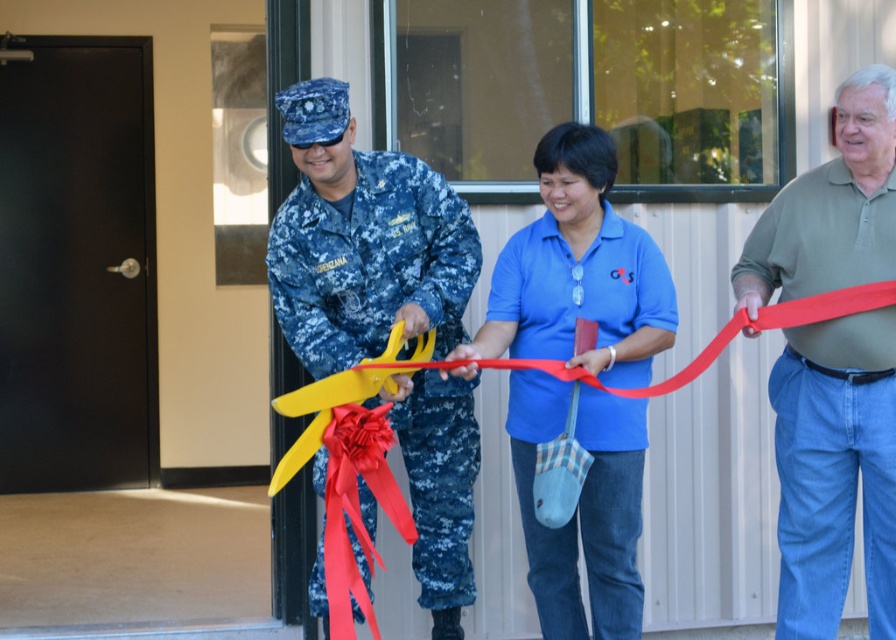
Does yellow matte scissors at center appear under silky red ribbon at center?

No, yellow matte scissors at center is not below silky red ribbon at center.

Measure the distance between yellow matte scissors at center and camera.

The distance of yellow matte scissors at center from camera is 13.41 feet.

You are a GUI agent. You are given a task and a screenshot of the screen. Output one action in this format:
    pyautogui.click(x=<x>, y=<y>)
    Task: Click on the yellow matte scissors at center
    
    Given the screenshot: What is the action you would take?
    pyautogui.click(x=564, y=381)

Is yellow matte scissors at center shorter than green cotton polo shirt at right?

Yes.

Who is taller, yellow matte scissors at center or green cotton polo shirt at right?

With more height is green cotton polo shirt at right.

Which is behind, point (627, 573) or point (786, 227)?

The point (627, 573) is behind.

Locate an element on the screen. Image resolution: width=896 pixels, height=640 pixels. yellow matte scissors at center is located at coordinates (564, 381).

Which is in front, point (597, 586) or point (438, 305)?

Positioned in front is point (438, 305).

Locate an element on the screen. This screenshot has height=640, width=896. blue cotton shirt at center is located at coordinates (578, 272).

This screenshot has height=640, width=896. Find the location of `blue cotton shirt at center`. blue cotton shirt at center is located at coordinates (578, 272).